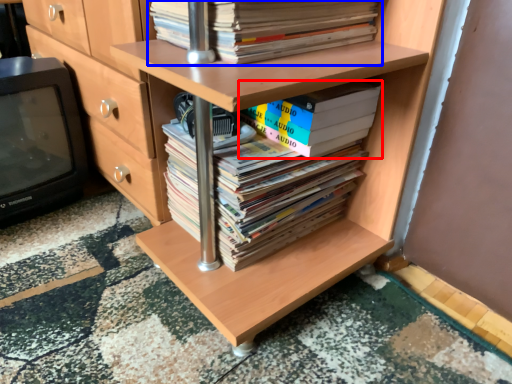
Question: Which point is further to the camera, book (highlighted by a red box) or book (highlighted by a blue box)?

Choices:
 (A) book
 (B) book

Answer: (A)